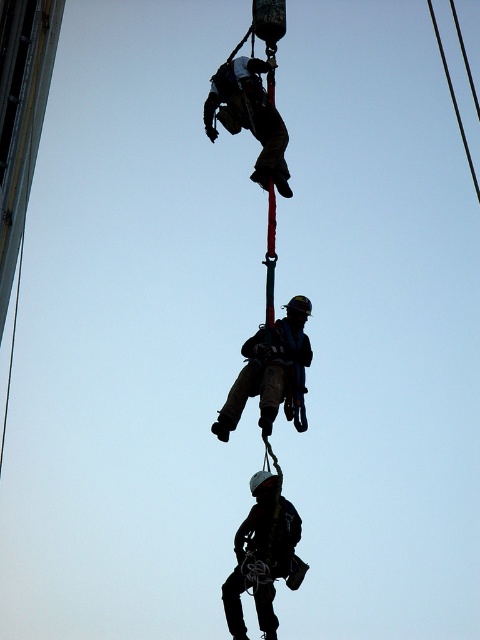
Does black matte helmet at center have a lesser width compared to matte black harness at upper center?

Correct, black matte helmet at center's width is less than matte black harness at upper center's.

Which is below, black matte helmet at center or matte black harness at upper center?

black matte helmet at center

Which is behind, point (279, 536) or point (236, 109)?

Point (236, 109)

The height and width of the screenshot is (640, 480). I want to click on black matte helmet at center, so click(x=263, y=556).

Between matte black harness at upper center and black wire at upper right, which one has less height?

matte black harness at upper center is shorter.

Between matte black harness at upper center and black wire at upper right, which one is positioned lower?

Positioned lower is matte black harness at upper center.

Which is in front, point (282, 141) or point (462, 136)?

Point (282, 141)

Locate an element on the screen. This screenshot has width=480, height=640. matte black harness at upper center is located at coordinates (250, 116).

Consider the image. Does black matte helmet at center appear on the left side of matte black helmet at center?

Yes, black matte helmet at center is to the left of matte black helmet at center.

Does black matte helmet at center come in front of matte black helmet at center?

No, it is not.

Locate an element on the screen. black matte helmet at center is located at coordinates (263, 556).